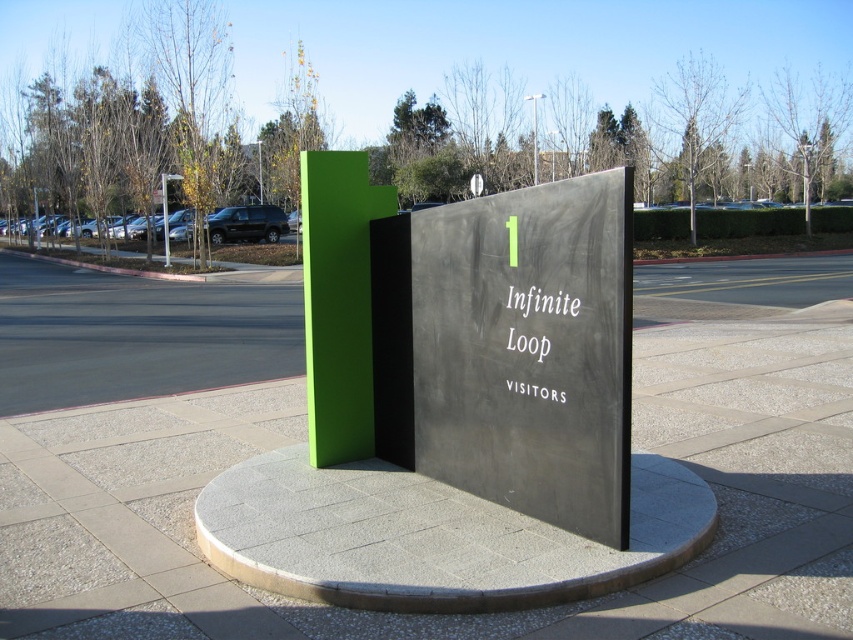
Does whitematerial/textureinfinite loop visitors at center appear under metallic pole at center?

Indeed, whitematerial/textureinfinite loop visitors at center is positioned under metallic pole at center.

Does whitematerial/textureinfinite loop visitors at center have a greater height compared to metallic pole at center?

No.

Is point (509, 300) closer to viewer compared to point (258, 161)?

Yes, it is.

Where is `whitematerial/textureinfinite loop visitors at center`? The width and height of the screenshot is (853, 640). whitematerial/textureinfinite loop visitors at center is located at coordinates (541, 301).

Is whitematerial/textureinfinite loop visitors at center closer to camera compared to green matte pole at center?

Yes.

Is whitematerial/textureinfinite loop visitors at center to the left of green matte pole at center from the viewer's perspective?

In fact, whitematerial/textureinfinite loop visitors at center is to the right of green matte pole at center.

Locate an element on the screen. Image resolution: width=853 pixels, height=640 pixels. whitematerial/textureinfinite loop visitors at center is located at coordinates (541, 301).

Can you confirm if green matte pole at center is wider than metallic pole at upper center?

Correct, the width of green matte pole at center exceeds that of metallic pole at upper center.

Is point (165, 173) closer to viewer compared to point (532, 100)?

Yes.

The image size is (853, 640). What are the coordinates of `green matte pole at center` in the screenshot? It's located at (165, 212).